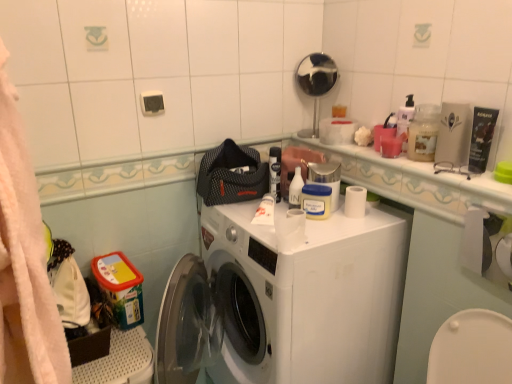
Where is `vacant area that is in front of matte black tube at upper right, marked as the first toiletry in a right-to-left arrangement`? vacant area that is in front of matte black tube at upper right, marked as the first toiletry in a right-to-left arrangement is located at coordinates (487, 184).